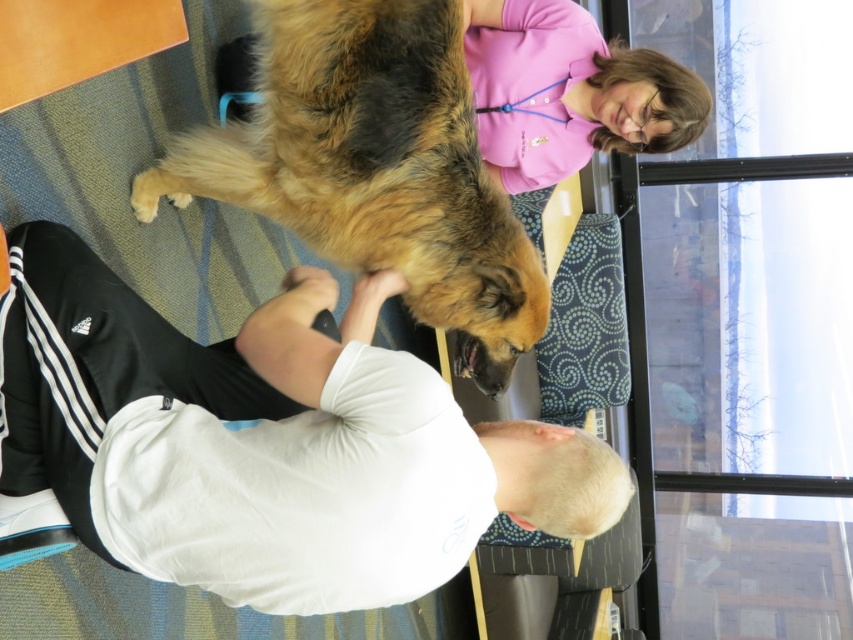
Question: Does white cotton shirt at upper center have a lesser width compared to golden fur dog at center?

Choices:
 (A) yes
 (B) no

Answer: (B)

Question: Is white cotton shirt at upper center smaller than golden fur dog at center?

Choices:
 (A) yes
 (B) no

Answer: (A)

Question: Does white cotton shirt at upper center appear over golden fur dog at center?

Choices:
 (A) yes
 (B) no

Answer: (B)

Question: Which object is farther from the camera taking this photo?

Choices:
 (A) golden fur dog at center
 (B) white cotton shirt at upper center

Answer: (A)